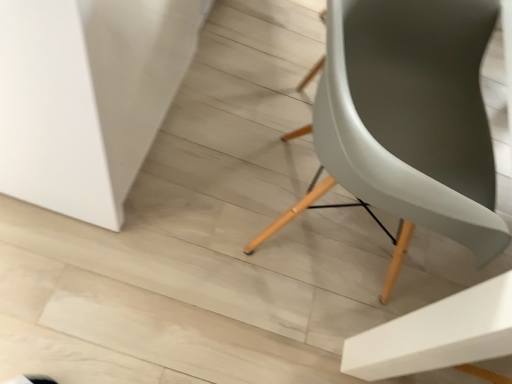
Measure the distance between point (351,108) and camera.

Point (351,108) is 24.80 inches from camera.

Where is `matte gray chair at center`? matte gray chair at center is located at coordinates (408, 120).

This screenshot has height=384, width=512. Describe the element at coordinates (408, 120) in the screenshot. I see `matte gray chair at center` at that location.

Measure the distance between point (14, 155) and camera.

They are 36.18 inches apart.

The height and width of the screenshot is (384, 512). Describe the element at coordinates (87, 96) in the screenshot. I see `white matte table at lower left` at that location.

Locate an element on the screen. This screenshot has width=512, height=384. white matte table at lower left is located at coordinates point(87,96).

Where is `matte gray chair at center`? matte gray chair at center is located at coordinates (408, 120).

Considering the relative positions of matte gray chair at center and white matte table at lower left in the image provided, is matte gray chair at center to the left of white matte table at lower left from the viewer's perspective?

No, matte gray chair at center is not to the left of white matte table at lower left.

Is matte gray chair at center behind white matte table at lower left?

No.

Which is farther from the camera, (377, 37) or (181, 45)?

The point (181, 45) is more distant.

From the image's perspective, is matte gray chair at center located above white matte table at lower left?

Incorrect, from the image's perspective, matte gray chair at center is lower than white matte table at lower left.

From a real-world perspective, who is located higher, matte gray chair at center or white matte table at lower left?

matte gray chair at center is physically above.

Considering the relative sizes of matte gray chair at center and white matte table at lower left in the image provided, is matte gray chair at center thinner than white matte table at lower left?

Correct, the width of matte gray chair at center is less than that of white matte table at lower left.

Who is taller, matte gray chair at center or white matte table at lower left?

Standing taller between the two is matte gray chair at center.

Is matte gray chair at center smaller than white matte table at lower left?

Yes, matte gray chair at center is smaller than white matte table at lower left.

Which is correct: matte gray chair at center is inside white matte table at lower left, or outside of it?

matte gray chair at center is spatially situated outside white matte table at lower left.

Is matte gray chair at center far from white matte table at lower left?

No, there isn't a large distance between matte gray chair at center and white matte table at lower left.

Is matte gray chair at center oriented towards white matte table at lower left?

No, matte gray chair at center is not aimed at white matte table at lower left.

Can you tell me how much matte gray chair at center and white matte table at lower left differ in facing direction?

The angular difference between matte gray chair at center and white matte table at lower left is 1.81 degrees.

At what (x,y) coordinates should I click in order to perform the action: click on chair that appears in front of the white matte table at lower left. Please return your answer as a coordinate pair (x, y). Looking at the image, I should click on (408, 120).

From the picture: Considering the relative positions of white matte table at lower left and matte gray chair at center in the image provided, is white matte table at lower left to the left or to the right of matte gray chair at center?

In the image, white matte table at lower left appears on the left side of matte gray chair at center.

Looking at this image, is white matte table at lower left further to the viewer compared to matte gray chair at center?

That is True.

Between point (152, 33) and point (425, 53), which one is positioned behind?

The point (425, 53) is behind.

From the image's perspective, is white matte table at lower left above matte gray chair at center?

Yes.

From a real-world perspective, is white matte table at lower left above or below matte gray chair at center?

From a real-world perspective, white matte table at lower left is physically below matte gray chair at center.

Looking at their sizes, would you say white matte table at lower left is wider or thinner than matte gray chair at center?

Considering their sizes, white matte table at lower left looks broader than matte gray chair at center.

From the picture: Which of these two, white matte table at lower left or matte gray chair at center, stands taller?

matte gray chair at center is taller.

Does white matte table at lower left have a larger size compared to matte gray chair at center?

Yes.

From the picture: Is matte gray chair at center a part of white matte table at lower left?

No, matte gray chair at center is located outside of white matte table at lower left.

Is white matte table at lower left not close to matte gray chair at center?

No, white matte table at lower left is in close proximity to matte gray chair at center.

Is white matte table at lower left facing towards matte gray chair at center?

Yes.

How different are the orientations of white matte table at lower left and matte gray chair at center in degrees?

The facing directions of white matte table at lower left and matte gray chair at center are 1.81 degrees apart.

The height and width of the screenshot is (384, 512). In order to click on table above the matte gray chair at center (from the image's perspective) in this screenshot , I will do `click(87, 96)`.

The height and width of the screenshot is (384, 512). Identify the location of table that appears on the left of matte gray chair at center. (87, 96).

In order to click on table above the matte gray chair at center (from the image's perspective) in this screenshot , I will do `click(87, 96)`.